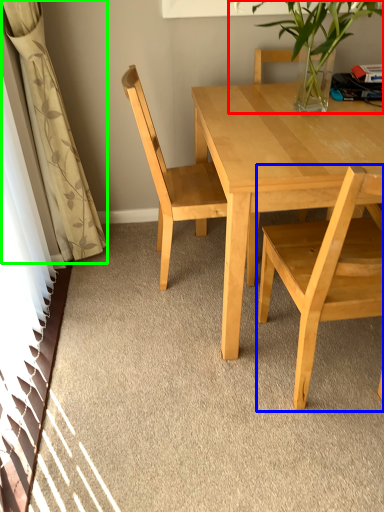
Question: Considering the real-world distances, which object is closest to houseplant (highlighted by a red box)? chair (highlighted by a blue box) or curtain (highlighted by a green box).

Choices:
 (A) chair
 (B) curtain

Answer: (A)